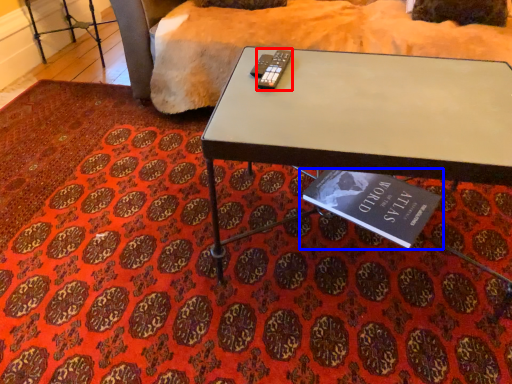
Question: Which object is further to the camera taking this photo, remote (highlighted by a red box) or book (highlighted by a blue box)?

Choices:
 (A) remote
 (B) book

Answer: (B)